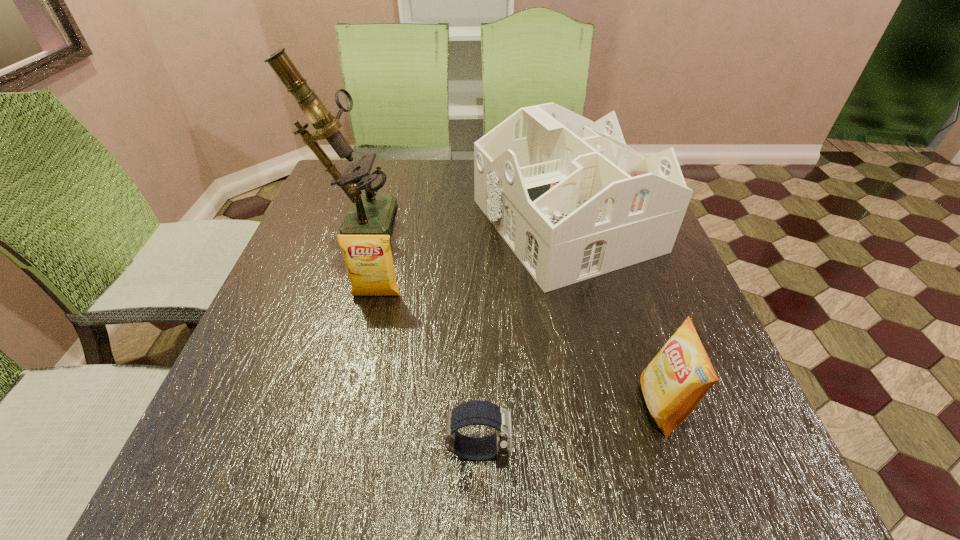
You are a GUI agent. You are given a task and a screenshot of the screen. Output one action in this format:
    pyautogui.click(x=<x>, y=<y>)
    Task: Click on the blank area located 0.050m on the front-facing side of the nearer crisp (potato chip)
    This screenshot has height=540, width=960.
    Given the screenshot: What is the action you would take?
    pyautogui.click(x=612, y=406)

Locate an element on the screen. The image size is (960, 540). vacant position located on the face of the watch is located at coordinates (547, 449).

The image size is (960, 540). In order to click on microscope that is at the far edge in this screenshot , I will do `click(368, 214)`.

I want to click on dollhouse at the far edge, so click(x=569, y=197).

At what (x,y) coordinates should I click in order to perform the action: click on object located at the near edge. Please return your answer as a coordinate pair (x, y). The height and width of the screenshot is (540, 960). Looking at the image, I should click on (477, 412).

This screenshot has height=540, width=960. In order to click on object located in the left edge section of the desktop in this screenshot , I will do `click(368, 214)`.

Find the location of `dollhouse present at the right edge`. dollhouse present at the right edge is located at coordinates (569, 197).

The image size is (960, 540). Identify the location of crisp (potato chip) present at the right edge. (676, 380).

Find the location of a particular element. object that is at the far left corner is located at coordinates (368, 214).

This screenshot has height=540, width=960. What are the coordinates of `object that is at the far right corner` in the screenshot? It's located at (569, 197).